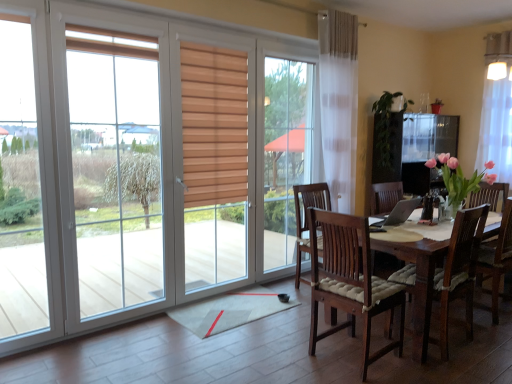
Question: Is silver metallic laptop at center in front of or behind white sheer curtain at upper right in the image?

Choices:
 (A) behind
 (B) front

Answer: (B)

Question: From a real-world perspective, relative to white sheer curtain at upper right, is silver metallic laptop at center vertically above or below?

Choices:
 (A) above
 (B) below

Answer: (B)

Question: In terms of width, does silver metallic laptop at center look wider or thinner when compared to white sheer curtain at upper right?

Choices:
 (A) wide
 (B) thin

Answer: (A)

Question: Would you say white sheer curtain at upper right is inside or outside silver metallic laptop at center?

Choices:
 (A) outside
 (B) inside

Answer: (A)

Question: From a real-world perspective, is white sheer curtain at upper right physically located above or below silver metallic laptop at center?

Choices:
 (A) below
 (B) above

Answer: (B)

Question: In terms of width, does white sheer curtain at upper right look wider or thinner when compared to silver metallic laptop at center?

Choices:
 (A) thin
 (B) wide

Answer: (A)

Question: Is point click(506, 77) closer or farther from the camera than point click(410, 201)?

Choices:
 (A) farther
 (B) closer

Answer: (A)